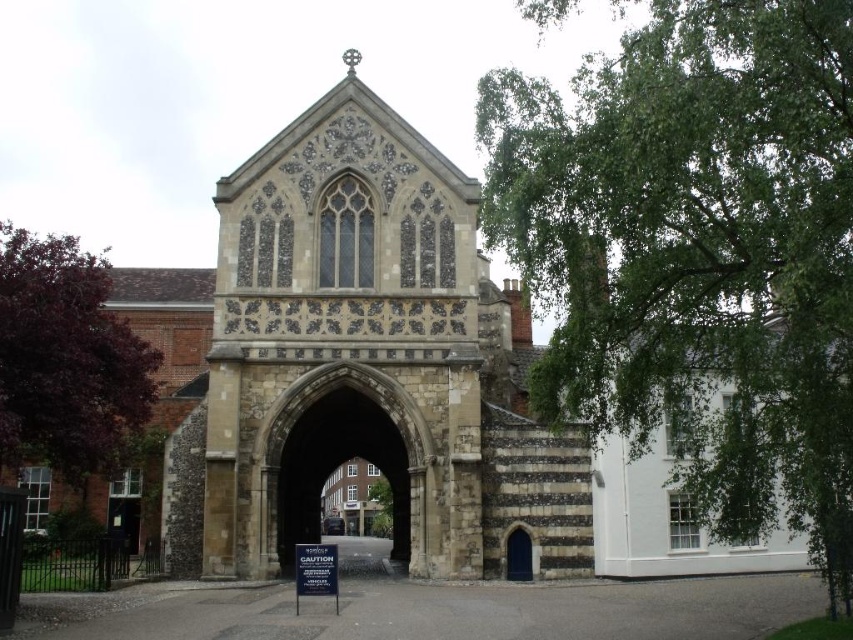
Question: Which point is closer to the camera?

Choices:
 (A) green leafy tree at right
 (B) green leafy tree at center
 (C) purple leafy tree at left
 (D) blue stone archway at center

Answer: (A)

Question: Does green leafy tree at right appear on the left side of purple leafy tree at left?

Choices:
 (A) no
 (B) yes

Answer: (A)

Question: Which point is closer to the camera?

Choices:
 (A) stone archway at center
 (B) green leafy tree at center
 (C) blue stone archway at center
 (D) purple leafy tree at left

Answer: (D)

Question: Based on their relative distances, which object is farther from the purple leafy tree at left?

Choices:
 (A) stone archway at center
 (B) blue stone archway at center
 (C) green leafy tree at right
 (D) green leafy tree at center

Answer: (C)

Question: In this image, where is purple leafy tree at left located relative to stone archway at center?

Choices:
 (A) right
 (B) left

Answer: (B)

Question: Does stone archway at center have a smaller size compared to green leafy tree at center?

Choices:
 (A) no
 (B) yes

Answer: (A)